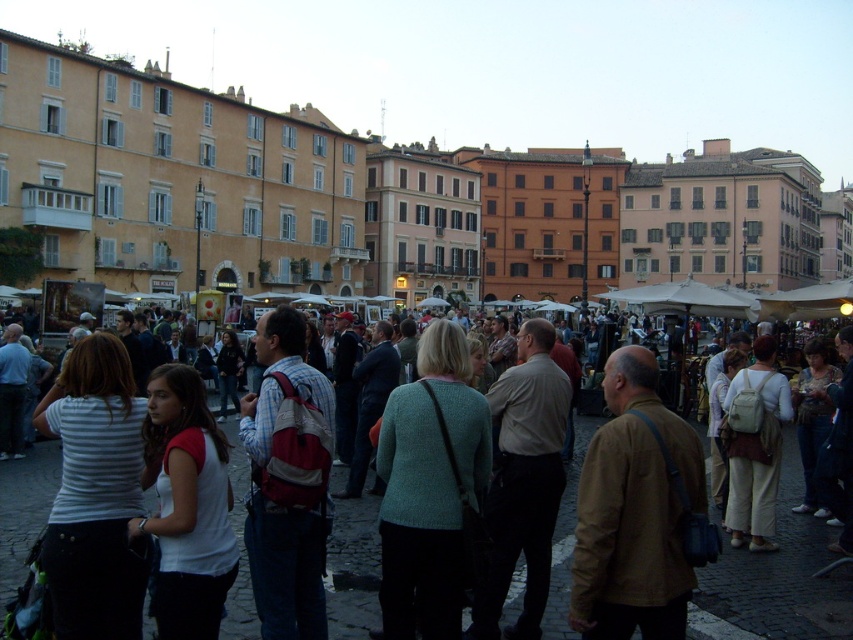
Which is behind, point (738, 225) or point (775, 608)?

The point (738, 225) is behind.

Between point (283, 136) and point (569, 490), which one is positioned behind?

Point (283, 136)

Where is `beige stone buildings at upper left`? The width and height of the screenshot is (853, 640). beige stone buildings at upper left is located at coordinates (268, 195).